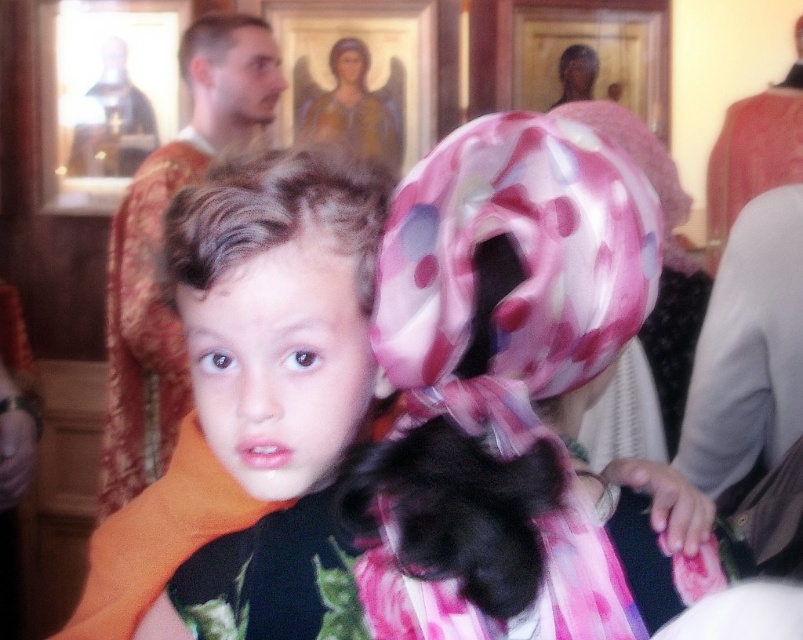
Locate an element on the screen. pink satin headscarf at center is located at coordinates (471, 420).

Can you confirm if pink satin headscarf at center is taller than orange fabric at left?

Incorrect, pink satin headscarf at center's height is not larger of orange fabric at left's.

Is point (585, 593) closer to viewer compared to point (251, 29)?

That is True.

Image resolution: width=803 pixels, height=640 pixels. What are the coordinates of `pink satin headscarf at center` in the screenshot? It's located at (471, 420).

Does point (473, 276) come behind point (194, 186)?

No, (473, 276) is closer to viewer.

Can you confirm if pink satin headscarf at center is positioned above matte orange scarf at center?

Incorrect, pink satin headscarf at center is not positioned above matte orange scarf at center.

At what (x,y) coordinates should I click in order to perform the action: click on pink satin headscarf at center. Please return your answer as a coordinate pair (x, y). Looking at the image, I should click on (471, 420).

Is pink satin headscarf at center further to the viewer compared to smooth skin face at upper left?

No, it is not.

Who is shorter, pink satin headscarf at center or smooth skin face at upper left?

smooth skin face at upper left

Does point (447, 300) come closer to viewer compared to point (215, 100)?

Yes, it is.

Where is `pink satin headscarf at center`? Image resolution: width=803 pixels, height=640 pixels. pink satin headscarf at center is located at coordinates (471, 420).